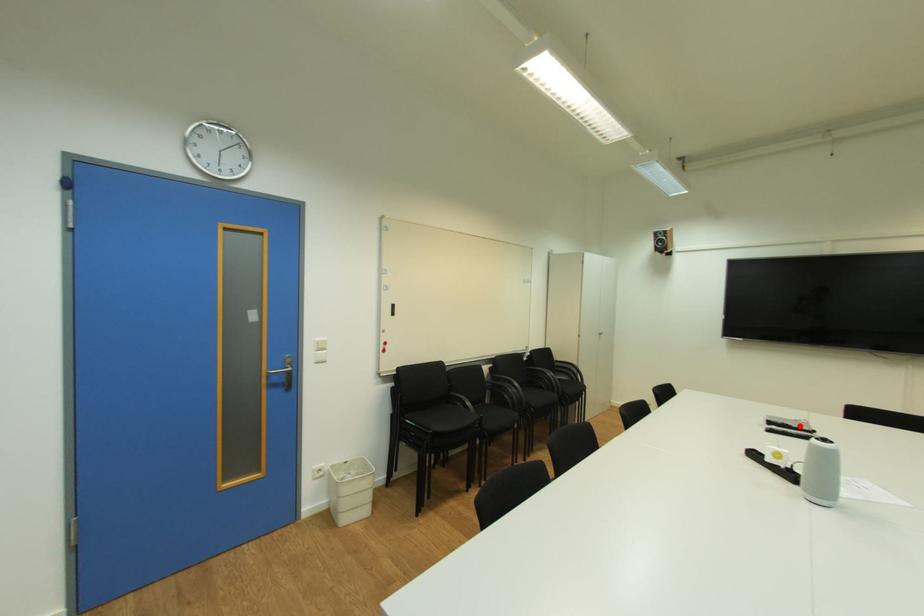
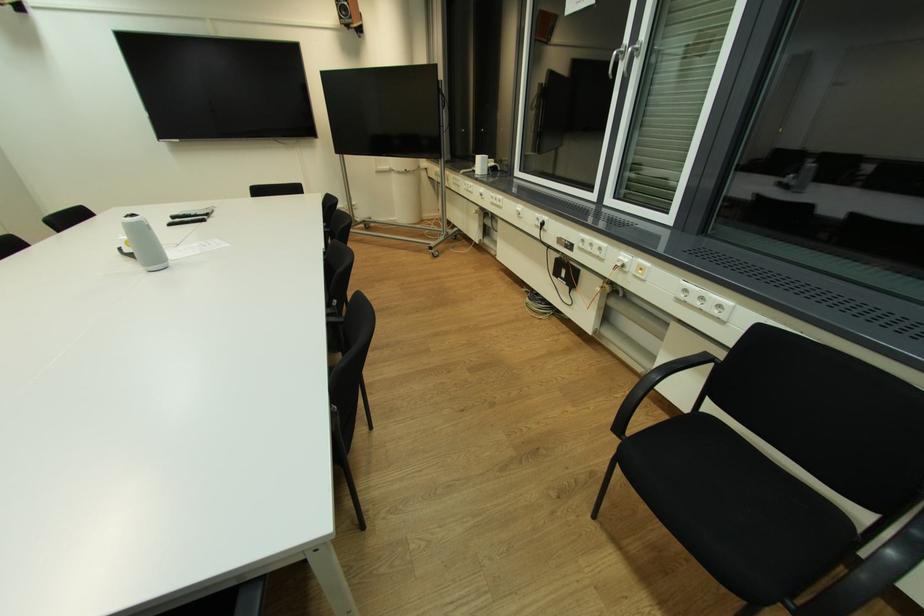
Question: I am providing you with two images of the same scene from different viewpoints. In image1, a red point is highlighted. Considering the same 3D point in image2, which of the following is correct?

Choices:
 (A) It is closer
 (B) It is farther

Answer: (A)